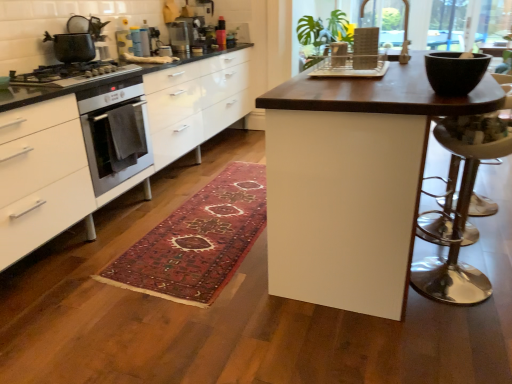
Question: From a real-world perspective, is polished silver bar stool at right physically located above or below metallic silver toaster at upper center, marked as the 2th appliance in a bottom-to-top arrangement?

Choices:
 (A) above
 (B) below

Answer: (B)

Question: In the image, is polished silver bar stool at right positioned in front of or behind metallic silver toaster at upper center, marked as the first appliance in a left-to-right arrangement?

Choices:
 (A) behind
 (B) front

Answer: (B)

Question: Estimate the real-world distances between objects in this image. Which object is farther from the carpeted rug at center?

Choices:
 (A) matte plastic dish rack at center, arranged as the first appliance when viewed from the right
 (B) black matte bowl at upper right
 (C) translucent plastic blender at upper center, the 3th appliance positioned from the front
 (D) matte black pot at upper left
 (E) dark wood table at center

Answer: (C)

Question: Which object is the farthest from the matte plastic dish rack at center, placed as the third appliance when sorted from top to bottom?

Choices:
 (A) matte black gas stove at left
 (B) matte black pot at upper left
 (C) polished silver bar stool at right
 (D) wooden lattice at upper right
 (E) dark wood table at center

Answer: (B)